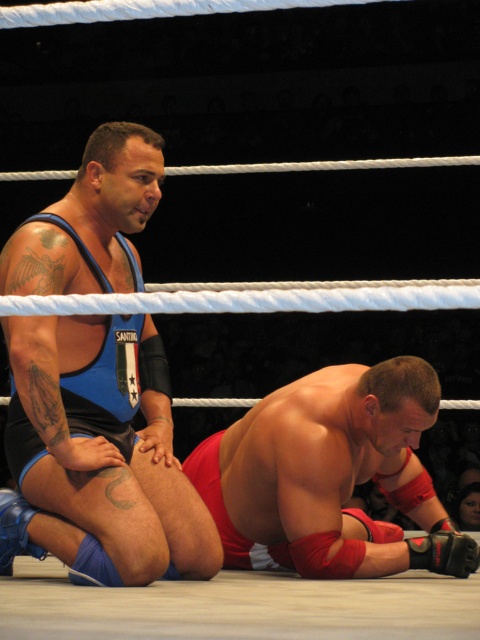
Which of these two, blue fabric singlet at left or smooth red wrestling mat at lower center, stands shorter?

smooth red wrestling mat at lower center

Which of these two, blue fabric singlet at left or smooth red wrestling mat at lower center, stands taller?

blue fabric singlet at left

Who is more forward, (x=90, y=317) or (x=346, y=422)?

Point (x=90, y=317)

The image size is (480, 640). In order to click on blue fabric singlet at left in this screenshot , I will do `click(100, 451)`.